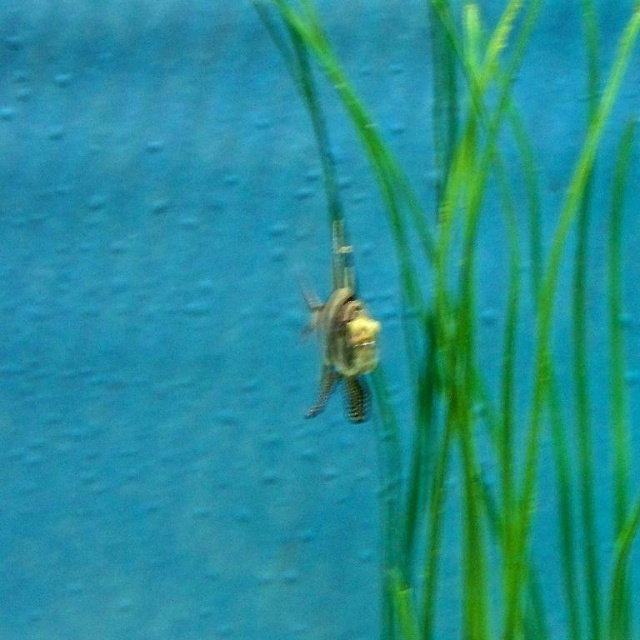
You are an underwater explorer with a 6 inch long measuring tool. You need to check the distance between the green leafy grass at center and the translucent plastic insect at center. Can your tool reach both objects at the same time?

The distance between the green leafy grass at center and the translucent plastic insect at center is 7.53 inches, which is longer than your 6 inch tool. Therefore, your tool cannot reach both objects simultaneously.

You are an underwater explorer examining the aquarium. You notice the green leafy grass at center and the translucent plastic insect at center. Which object is taller?

The green leafy grass at center is taller than the translucent plastic insect at center.